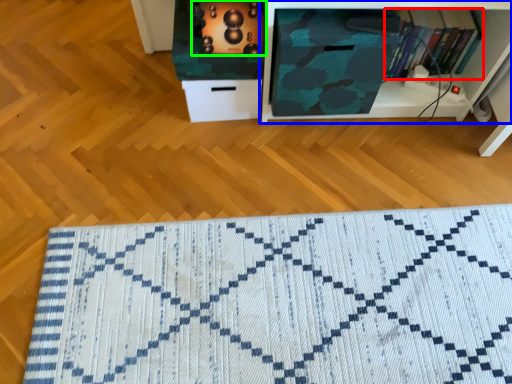
Question: Which object is the farthest from book (highlighted by a red box)? Choose among these: shelf (highlighted by a blue box) or appliance (highlighted by a green box).

Choices:
 (A) shelf
 (B) appliance

Answer: (B)